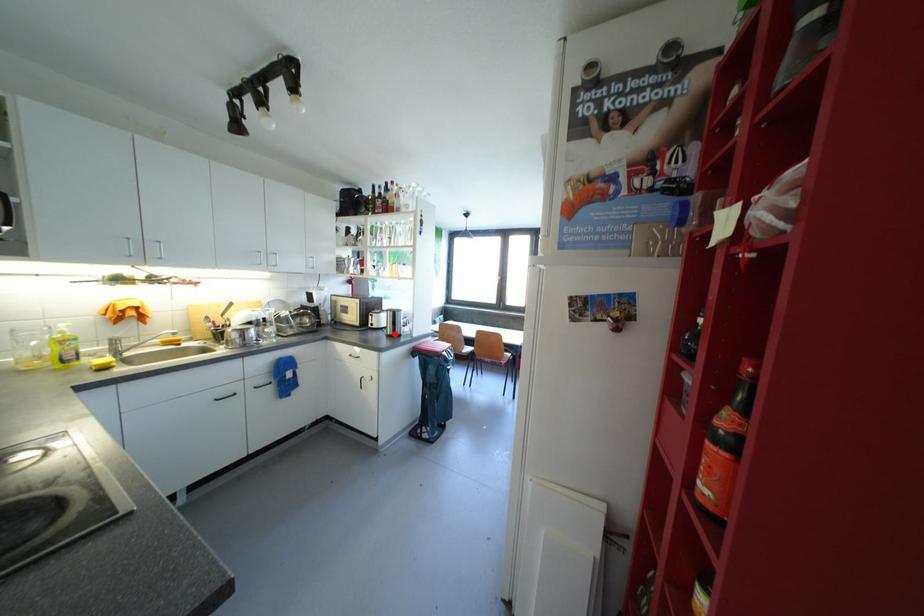
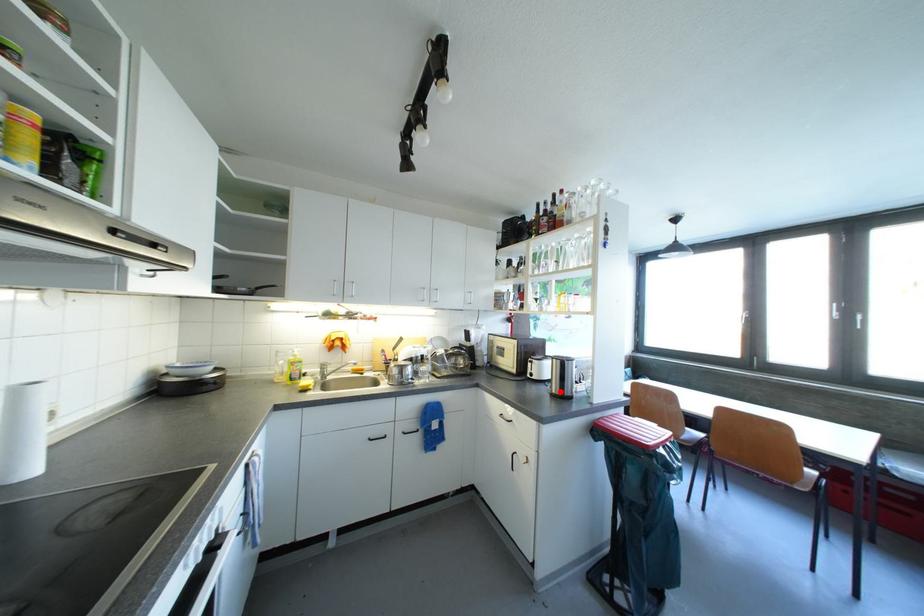
I am providing you with two images of the same scene from different viewpoints. A red point is marked on the first image and another point is marked on the second image. Does the point marked in image1 correspond to the same location as the one in image2?

Yes